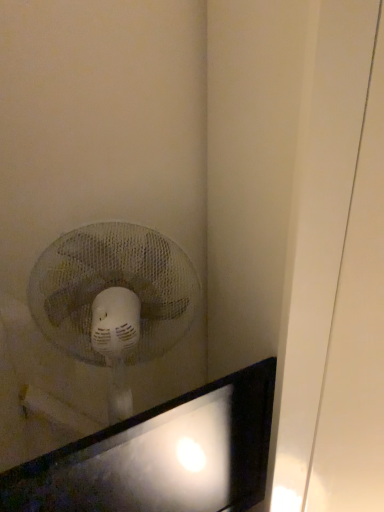
Question: Looking at their shapes, would you say matte black monitor at lower left is wider or thinner than white plastic fan at upper left?

Choices:
 (A) wide
 (B) thin

Answer: (B)

Question: From a real-world perspective, relative to white plastic fan at upper left, is matte black monitor at lower left vertically above or below?

Choices:
 (A) below
 (B) above

Answer: (A)

Question: From the image's perspective, is matte black monitor at lower left positioned above or below white plastic fan at upper left?

Choices:
 (A) below
 (B) above

Answer: (A)

Question: From a real-world perspective, is white plastic fan at upper left positioned above or below matte black monitor at lower left?

Choices:
 (A) above
 (B) below

Answer: (A)

Question: Considering the positions of white plastic fan at upper left and matte black monitor at lower left in the image, is white plastic fan at upper left wider or thinner than matte black monitor at lower left?

Choices:
 (A) wide
 (B) thin

Answer: (A)

Question: Is point (139, 327) positioned closer to the camera than point (36, 489)?

Choices:
 (A) closer
 (B) farther

Answer: (B)

Question: Is white plastic fan at upper left situated inside matte black monitor at lower left or outside?

Choices:
 (A) outside
 (B) inside

Answer: (A)